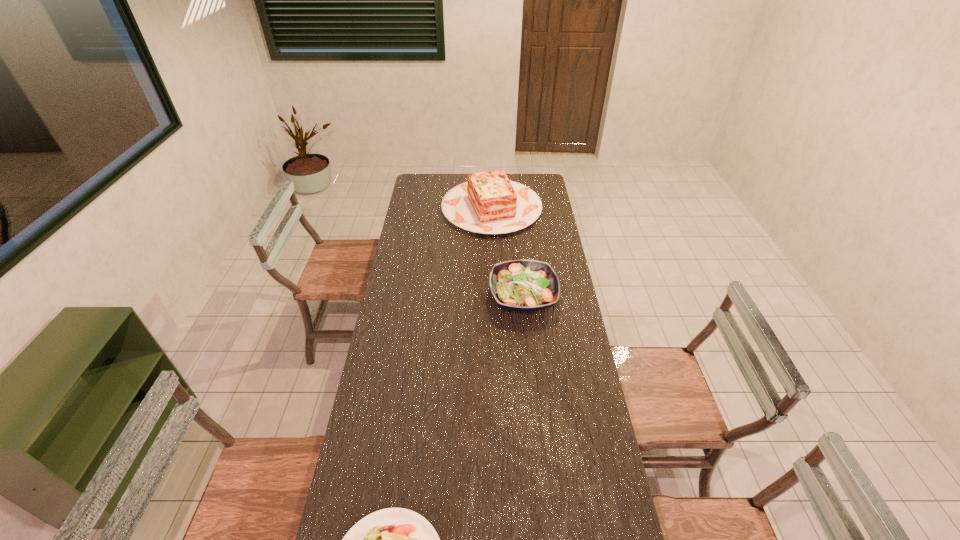
Find the location of a particular element. the tallest object is located at coordinates (488, 203).

The height and width of the screenshot is (540, 960). Find the location of `the farthest object`. the farthest object is located at coordinates (488, 203).

At what (x,y) coordinates should I click in order to perform the action: click on the farther salad plate. Please return your answer as a coordinate pair (x, y). Looking at the image, I should click on (522, 285).

Identify the location of the taller salad plate. (522, 285).

Where is `free space located 0.070m on the left of the lasagna`? This screenshot has width=960, height=540. free space located 0.070m on the left of the lasagna is located at coordinates (429, 208).

You are a GUI agent. You are given a task and a screenshot of the screen. Output one action in this format:
    pyautogui.click(x=<x>, y=<y>)
    Task: Click on the free space located 0.110m on the back of the right salad plate
    
    Given the screenshot: What is the action you would take?
    pyautogui.click(x=519, y=259)

Image resolution: width=960 pixels, height=540 pixels. I want to click on object present at the far edge, so click(488, 203).

You are a GUI agent. You are given a task and a screenshot of the screen. Output one action in this format:
    pyautogui.click(x=<x>, y=<y>)
    Task: Click on the lasagna present at the right edge
    The height and width of the screenshot is (540, 960).
    Given the screenshot: What is the action you would take?
    [488, 203]

The height and width of the screenshot is (540, 960). What are the coordinates of `salad plate that is at the right edge` in the screenshot? It's located at (522, 285).

Where is `object situated at the far right corner`? The image size is (960, 540). object situated at the far right corner is located at coordinates (488, 203).